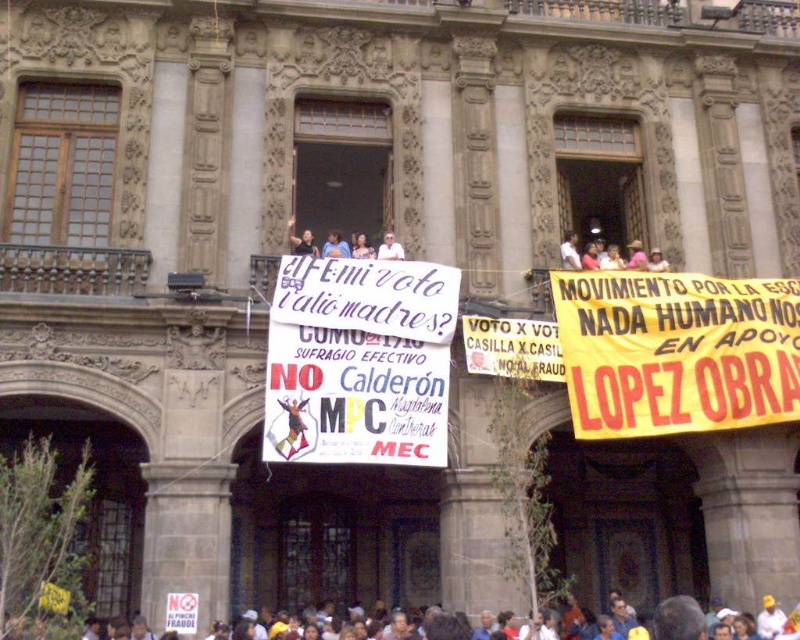
You are a photographer standing at the front of the crowd. You want to take a photo of the dark blue shirt at center without any banners blocking it. The banners are hung above the crowd. Based on the coordinates provided, can you position yourself to capture the shirt without the banners obscuring it?

The dark blue shirt at center is located at coordinates point (302, 241). Since the banners are hung above the crowd, positioning yourself at an angle or lower height should allow you to capture the shirt without the banners blocking it.

You are a photographer standing at the base of the building. You want to capture a photo of the white paper sign at center without any of the protesters in the foreground blocking it. Is this possible given your current position?

The protesters are 42.87 meters away from the white paper sign at center. Since the distance is significant, it is likely possible to capture a clear photo of the white paper sign at center without obstruction from the protesters in the foreground.